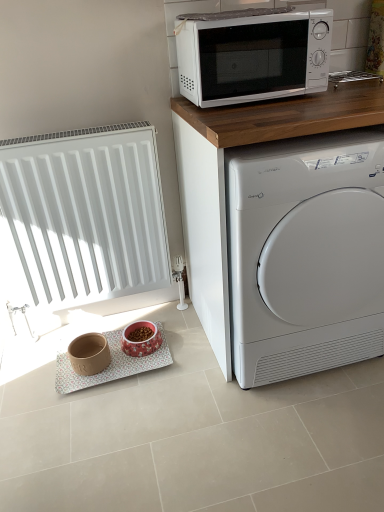
Find the location of a particular element. Image resolution: width=384 pixels, height=512 pixels. free space in front of white glossy washing machine at right is located at coordinates (281, 437).